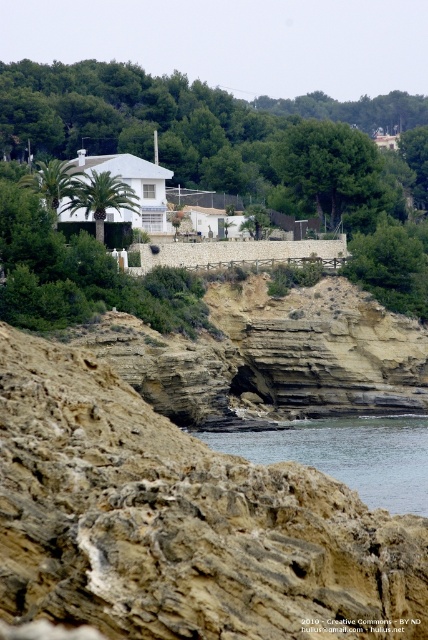
Does brown rocky cliff at lower left come behind clear water at lower center?

No, it is in front of clear water at lower center.

Can you confirm if brown rocky cliff at lower left is wider than clear water at lower center?

Incorrect, brown rocky cliff at lower left's width does not surpass clear water at lower center's.

The width and height of the screenshot is (428, 640). What do you see at coordinates (180, 522) in the screenshot?
I see `brown rocky cliff at lower left` at bounding box center [180, 522].

At what (x,y) coordinates should I click in order to perform the action: click on brown rocky cliff at lower left. Please return your answer as a coordinate pair (x, y). Looking at the image, I should click on (180, 522).